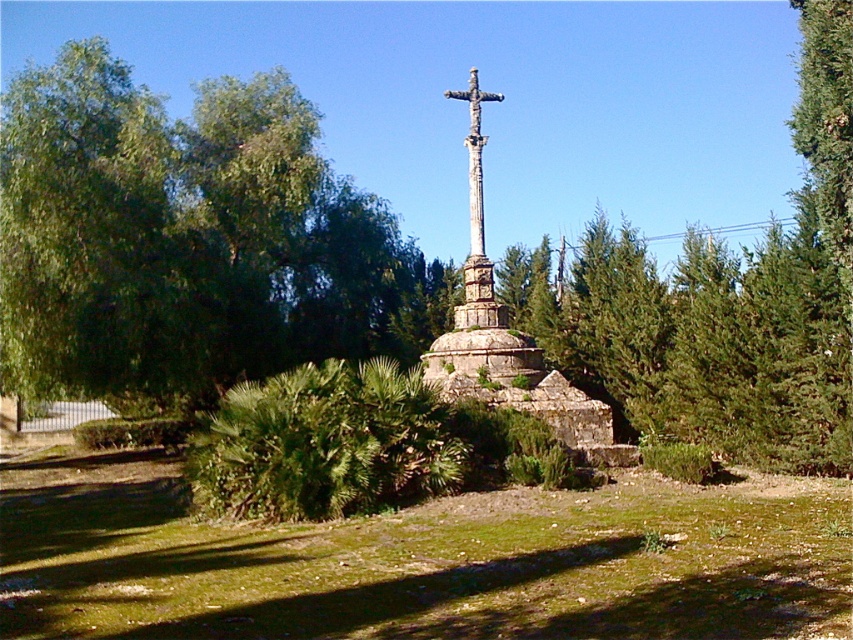
You are standing in front of the monument and notice two stone crosses. The first is labeled as the stone cross at center, and the second is the stone textured cross at center. Which one is closer to you?

The stone cross at center is closer to you because it is in front of the stone textured cross at center.